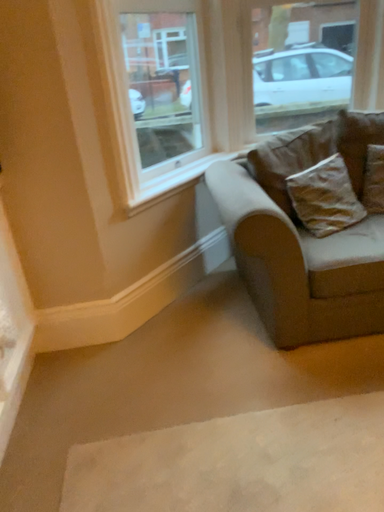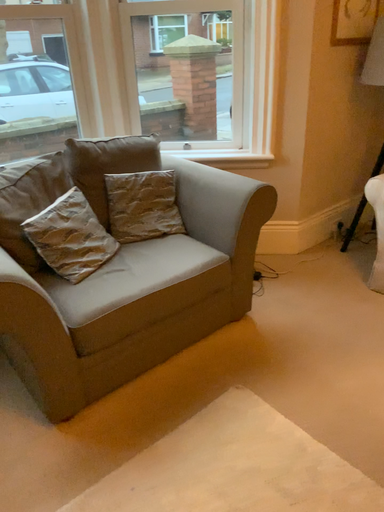
Question: How did the camera likely rotate when shooting the video?

Choices:
 (A) rotated left
 (B) rotated right

Answer: (B)